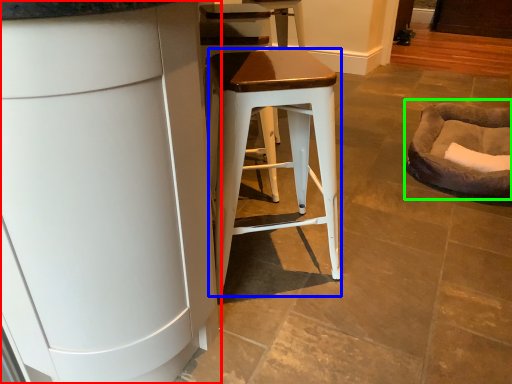
Question: Estimate the real-world distances between objects in this image. Which object is farther from cabinetry (highlighted by a red box), stool (highlighted by a blue box) or bean bag chair (highlighted by a green box)?

Choices:
 (A) stool
 (B) bean bag chair

Answer: (B)